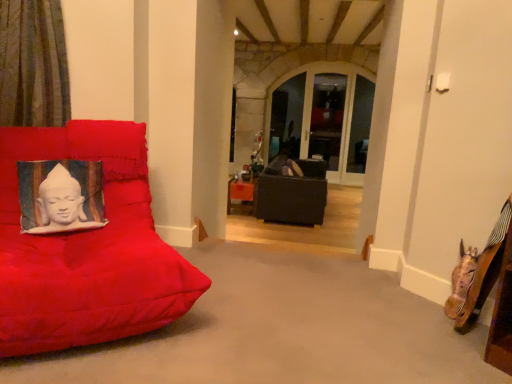
Question: Considering their positions, is suede red cushion at left, the 2th furniture positioned from the back, located in front of or behind clear glass window at center?

Choices:
 (A) behind
 (B) front

Answer: (B)

Question: Looking at their shapes, would you say suede red cushion at left, acting as the 2th furniture starting from the right, is wider or thinner than clear glass window at center?

Choices:
 (A) wide
 (B) thin

Answer: (A)

Question: Based on their relative distances, which object is farther from the suede red cushion at left, acting as the 2th furniture starting from the right?

Choices:
 (A) matte black couch at center, marked as the 2th furniture in a left-to-right arrangement
 (B) green striped curtain at left
 (C) clear glass window at center
 (D) silk cushion with buddha print at left

Answer: (C)

Question: Which object is the closest to the matte black couch at center, which is the first furniture from right to left?

Choices:
 (A) silk cushion with buddha print at left
 (B) green striped curtain at left
 (C) clear glass window at center
 (D) suede red cushion at left, acting as the 2th furniture starting from the right

Answer: (A)